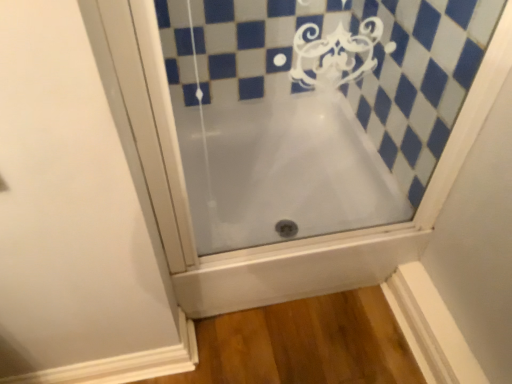
What do you see at coordinates (296, 206) in the screenshot? I see `white glossy bathtub at center` at bounding box center [296, 206].

Locate an element on the screen. white glossy bathtub at center is located at coordinates (296, 206).

Measure the distance between point (254, 302) and camera.

The distance of point (254, 302) from camera is 1.24 meters.

Image resolution: width=512 pixels, height=384 pixels. What do you see at coordinates (330, 111) in the screenshot? I see `white frosted glass bathtub at center` at bounding box center [330, 111].

Locate an element on the screen. white frosted glass bathtub at center is located at coordinates (330, 111).

In order to face white frosted glass bathtub at center, should I rotate leftwards or rightwards?

It's best to rotate right around 8.953 degrees.

At what (x,y) coordinates should I click in order to perform the action: click on white glossy bathtub at center. Please return your answer as a coordinate pair (x, y). Looking at the image, I should click on (296, 206).

In the scene shown: Which object is positioned more to the left, white glossy bathtub at center or white frosted glass bathtub at center?

white glossy bathtub at center is more to the left.

Considering the positions of objects white glossy bathtub at center and white frosted glass bathtub at center in the image provided, who is in front, white glossy bathtub at center or white frosted glass bathtub at center?

white frosted glass bathtub at center is in front.

Considering the points (231, 186) and (262, 192), which point is in front, point (231, 186) or point (262, 192)?

The point (262, 192) is closer.

From the image's perspective, is white glossy bathtub at center under white frosted glass bathtub at center?

Indeed, from the image's perspective, white glossy bathtub at center is shown beneath white frosted glass bathtub at center.

From a real-world perspective, is white glossy bathtub at center above or below white frosted glass bathtub at center?

From a real-world perspective, white glossy bathtub at center is physically below white frosted glass bathtub at center.

Considering the relative sizes of white glossy bathtub at center and white frosted glass bathtub at center in the image provided, is white glossy bathtub at center thinner than white frosted glass bathtub at center?

No.

Considering the sizes of objects white glossy bathtub at center and white frosted glass bathtub at center in the image provided, who is shorter, white glossy bathtub at center or white frosted glass bathtub at center?

Standing shorter between the two is white glossy bathtub at center.

Which of these two, white glossy bathtub at center or white frosted glass bathtub at center, is smaller?

With smaller size is white frosted glass bathtub at center.

Would you say white frosted glass bathtub at center is part of white glossy bathtub at center's contents?

No, white frosted glass bathtub at center is not a part of white glossy bathtub at center.

Based on the photo, are white glossy bathtub at center and white frosted glass bathtub at center beside each other?

Yes, white glossy bathtub at center and white frosted glass bathtub at center clearly make contact.

Is white glossy bathtub at center facing away from white frosted glass bathtub at center?

No, white glossy bathtub at center is not facing away from white frosted glass bathtub at center.

Can you tell me how much white glossy bathtub at center and white frosted glass bathtub at center differ in facing direction?

They differ by 0.00322 degrees in their facing directions.

What are the coordinates of `bathtub below the white frosted glass bathtub at center (from a real-world perspective)` in the screenshot? It's located at (296, 206).

Considering the relative positions of white frosted glass bathtub at center and white glossy bathtub at center in the image provided, is white frosted glass bathtub at center to the left or to the right of white glossy bathtub at center?

Based on their positions, white frosted glass bathtub at center is located to the right of white glossy bathtub at center.

Who is more distant, white frosted glass bathtub at center or white glossy bathtub at center?

white glossy bathtub at center is further from the camera.

Which point is more forward, (234, 7) or (361, 246)?

The point (361, 246) is closer.

From the image's perspective, which is above, white frosted glass bathtub at center or white glossy bathtub at center?

white frosted glass bathtub at center appears higher in the image.

From a real-world perspective, is white frosted glass bathtub at center beneath white glossy bathtub at center?

No, from a real-world perspective, white frosted glass bathtub at center is not under white glossy bathtub at center.

Considering the sizes of objects white frosted glass bathtub at center and white glossy bathtub at center in the image provided, who is wider, white frosted glass bathtub at center or white glossy bathtub at center?

white glossy bathtub at center is wider.

Between white frosted glass bathtub at center and white glossy bathtub at center, which one has more height?

white frosted glass bathtub at center.

Considering the relative sizes of white frosted glass bathtub at center and white glossy bathtub at center in the image provided, is white frosted glass bathtub at center bigger than white glossy bathtub at center?

No.

Can white glossy bathtub at center be found inside white frosted glass bathtub at center?

No, white glossy bathtub at center is located outside of white frosted glass bathtub at center.

In the scene shown: Is white frosted glass bathtub at center touching white glossy bathtub at center?

Yes, the surface of white frosted glass bathtub at center is in contact with white glossy bathtub at center.

Is white frosted glass bathtub at center facing away from white glossy bathtub at center?

Yes.

How different are the orientations of white frosted glass bathtub at center and white glossy bathtub at center in degrees?

The angle between the facing direction of white frosted glass bathtub at center and the facing direction of white glossy bathtub at center is 0.00322 degrees.

Measure the distance from white frosted glass bathtub at center to white glossy bathtub at center.

They are 3.61 inches apart.

There is a white glossy bathtub at center. Where is `bath above it (from a real-world perspective)`? bath above it (from a real-world perspective) is located at coordinates (330, 111).

The image size is (512, 384). I want to click on bath on the right of white glossy bathtub at center, so click(330, 111).

The image size is (512, 384). What are the coordinates of `bath that appears above the white glossy bathtub at center (from the image's perspective)` in the screenshot? It's located at (330, 111).